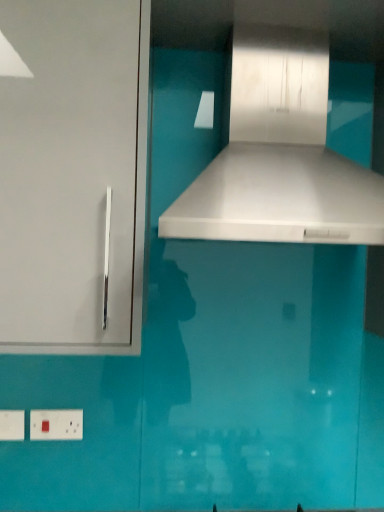
Question: Considering the relative sizes of white glossy vent at center and white plastic electric outlet at lower left, the first electric outlet viewed from the left, in the image provided, is white glossy vent at center shorter than white plastic electric outlet at lower left, the first electric outlet viewed from the left,?

Choices:
 (A) no
 (B) yes

Answer: (A)

Question: Are white glossy vent at center and white plastic electric outlet at lower left, arranged as the second electric outlet when viewed from the right, located far from each other?

Choices:
 (A) yes
 (B) no

Answer: (A)

Question: Considering the relative positions of white glossy vent at center and white plastic electric outlet at lower left, the first electric outlet viewed from the left, in the image provided, is white glossy vent at center behind white plastic electric outlet at lower left, the first electric outlet viewed from the left,?

Choices:
 (A) yes
 (B) no

Answer: (B)

Question: Considering the relative sizes of white glossy vent at center and white plastic electric outlet at lower left, arranged as the second electric outlet when viewed from the right, in the image provided, is white glossy vent at center wider than white plastic electric outlet at lower left, arranged as the second electric outlet when viewed from the right,?

Choices:
 (A) yes
 (B) no

Answer: (A)

Question: Is white glossy vent at center taller than white plastic electric outlet at lower left, the first electric outlet viewed from the left?

Choices:
 (A) yes
 (B) no

Answer: (A)

Question: Can you confirm if white glossy vent at center is bigger than white plastic electric outlet at lower left, arranged as the second electric outlet when viewed from the right?

Choices:
 (A) yes
 (B) no

Answer: (A)

Question: Would you say white plastic electric outlet at lower left, arranged as the second electric outlet when viewed from the right, is part of white glossy cabinet handle at left's contents?

Choices:
 (A) yes
 (B) no

Answer: (B)

Question: Considering the relative sizes of white glossy cabinet handle at left and white plastic electric outlet at lower left, the first electric outlet viewed from the left, in the image provided, is white glossy cabinet handle at left bigger than white plastic electric outlet at lower left, the first electric outlet viewed from the left,?

Choices:
 (A) yes
 (B) no

Answer: (A)

Question: Does white glossy cabinet handle at left come in front of white plastic electric outlet at lower left, the first electric outlet viewed from the left?

Choices:
 (A) no
 (B) yes

Answer: (B)

Question: Is white glossy cabinet handle at left not near white plastic electric outlet at lower left, arranged as the second electric outlet when viewed from the right?

Choices:
 (A) no
 (B) yes

Answer: (A)

Question: From the image's perspective, would you say white glossy cabinet handle at left is positioned over white plastic electric outlet at lower left, arranged as the second electric outlet when viewed from the right?

Choices:
 (A) yes
 (B) no

Answer: (A)

Question: Are white glossy cabinet handle at left and white plastic electric outlet at lower left, arranged as the second electric outlet when viewed from the right, beside each other?

Choices:
 (A) yes
 (B) no

Answer: (B)

Question: Can you confirm if white glossy vent at center is wider than white glossy cabinet handle at left?

Choices:
 (A) yes
 (B) no

Answer: (A)